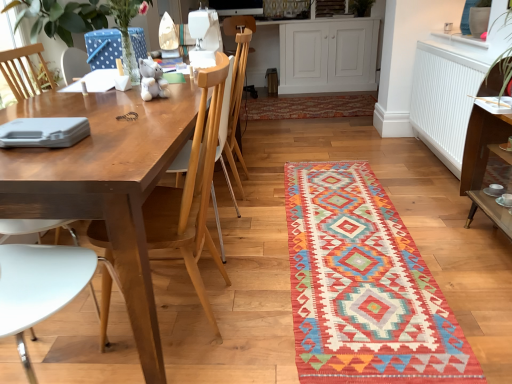
The image size is (512, 384). What are the coordinates of `free space underneath multicolored woven mat at center (from a real-world perspective)` in the screenshot? It's located at (353, 251).